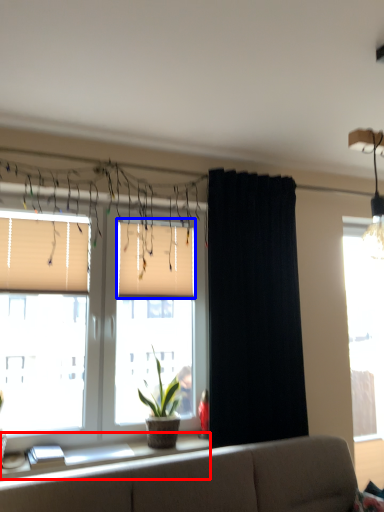
Question: Among these objects, which one is farthest to the camera, window sill (highlighted by a red box) or window blind (highlighted by a blue box)?

Choices:
 (A) window sill
 (B) window blind

Answer: (B)